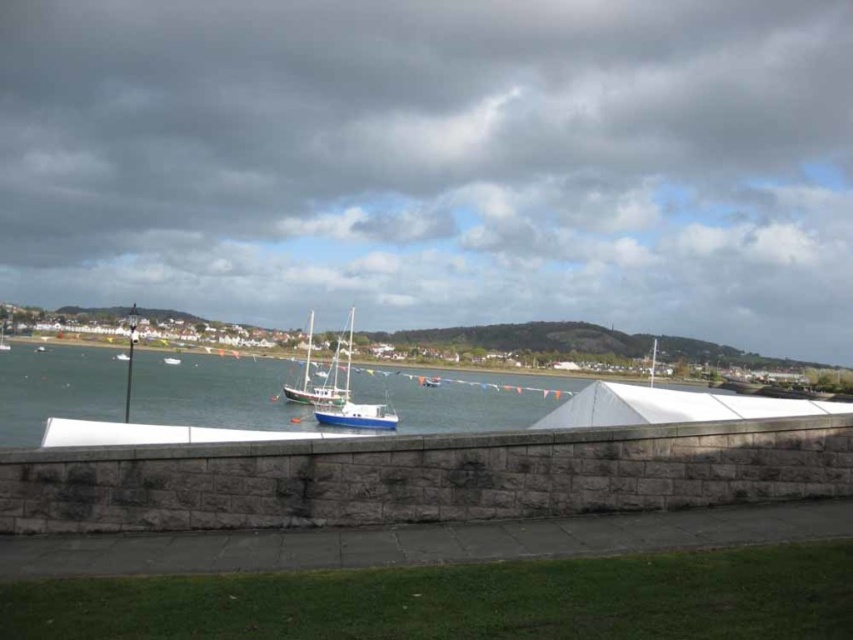
Does wooden sailboat at center have a greater height compared to blue polished wood sailboat at center?

No, wooden sailboat at center is not taller than blue polished wood sailboat at center.

Who is positioned more to the right, wooden sailboat at center or blue polished wood sailboat at center?

blue polished wood sailboat at center

At what (x,y) coordinates should I click in order to perform the action: click on wooden sailboat at center. Please return your answer as a coordinate pair (x, y). This screenshot has width=853, height=640. Looking at the image, I should click on (328, 372).

I want to click on wooden sailboat at center, so click(x=328, y=372).